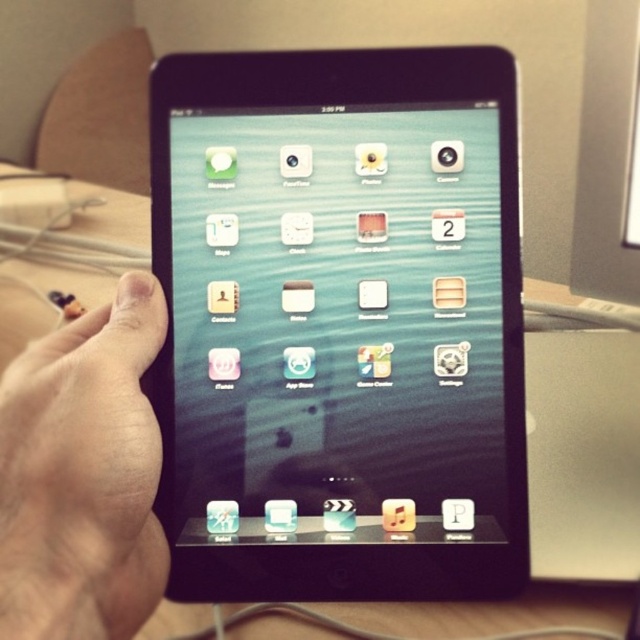
Who is taller, skinny beige hand at lower left or wooden table at center?

wooden table at center is taller.

Find the location of a particular element. Image resolution: width=640 pixels, height=640 pixels. skinny beige hand at lower left is located at coordinates (83, 474).

This screenshot has height=640, width=640. Find the location of `skinny beige hand at lower left`. skinny beige hand at lower left is located at coordinates (83, 474).

Who is positioned more to the right, black glossy tablet at center or skinny beige hand at lower left?

black glossy tablet at center

Does black glossy tablet at center appear on the right side of skinny beige hand at lower left?

Yes, black glossy tablet at center is to the right of skinny beige hand at lower left.

Is point (252, 88) positioned behind point (24, 410)?

Yes.

This screenshot has width=640, height=640. Identify the location of black glossy tablet at center. (339, 324).

Is point (244, 426) positioned before point (44, 275)?

Yes, it is in front of point (44, 275).

Which is above, black glossy tablet at center or wooden table at center?

Positioned higher is wooden table at center.

Who is more distant from viewer, (x=285, y=164) or (x=29, y=324)?

The point (x=29, y=324) is behind.

The width and height of the screenshot is (640, 640). Identify the location of black glossy tablet at center. (339, 324).